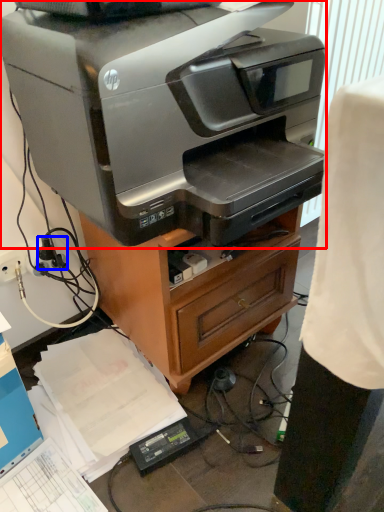
Question: Which of the following is the farthest to the observer, printer (highlighted by a red box) or plug (highlighted by a blue box)?

Choices:
 (A) printer
 (B) plug

Answer: (B)